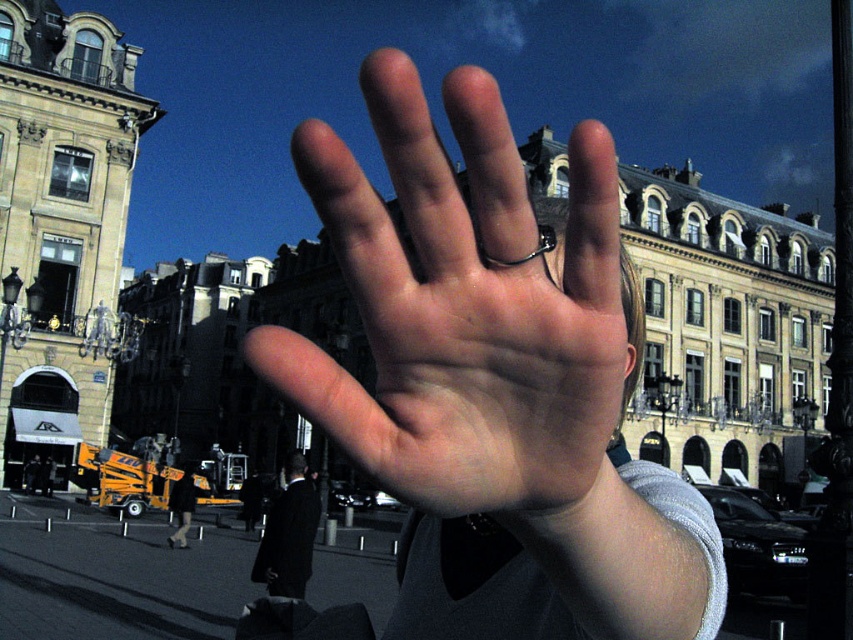
Based on the scene description, where is the dark suit located in relation to the hand? Please provide coordinates in the format of point coordinates like point (288, 534). The hand is at the center of the image.

The dark suit is located at point (288, 534), which is at the center of the image. Since the hand is also at the center, the dark suit is positioned at the same central area as the hand.

You are a fashion stylist preparing for a photoshoot. You see a dark suit at center and a silver metallic ring at center in the image. Which item is positioned lower in the scene?

The dark suit at center is located below the silver metallic ring at center, so the dark suit at center is positioned lower in the scene.